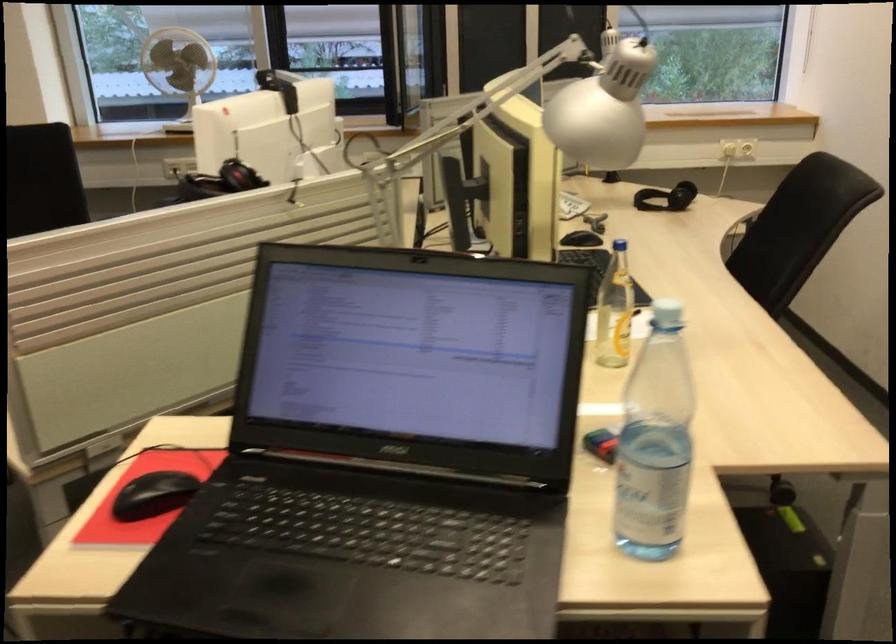
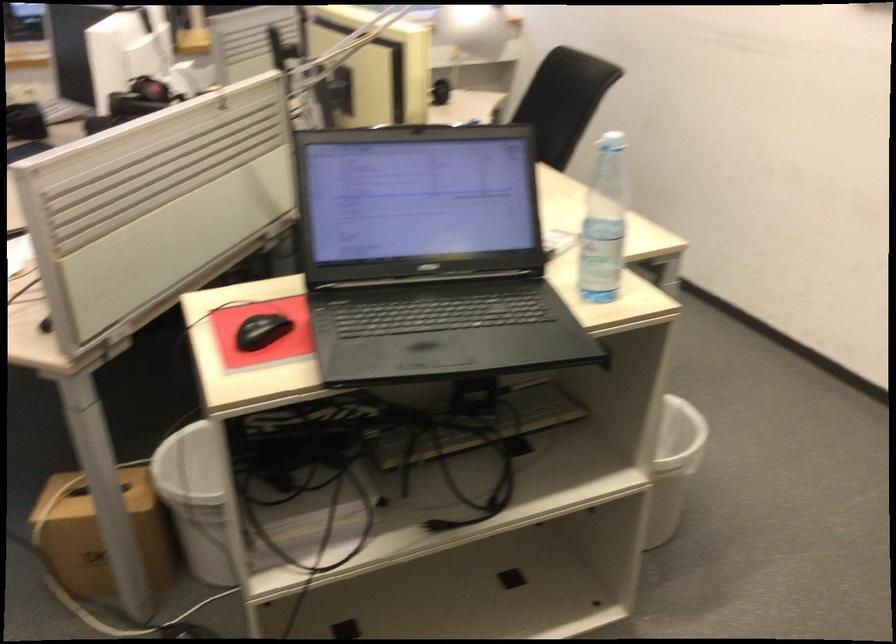
Where in the second image is the point corresponding to [668,323] from the first image?

(612, 142)